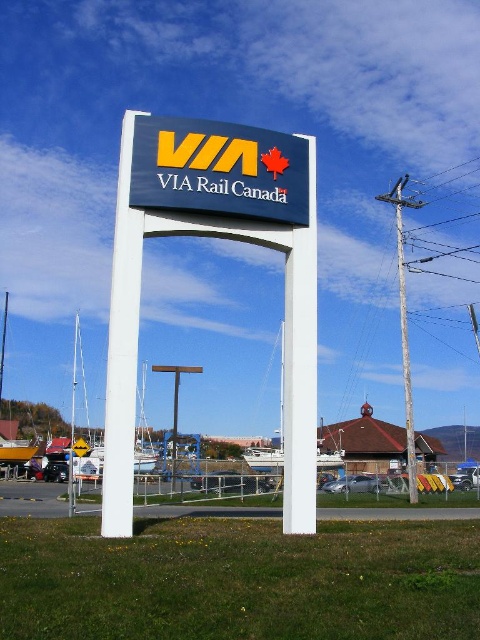
Question: Based on their relative distances, which object is nearer to the blue matte sign at center?

Choices:
 (A) weathered wood utility pole at right
 (B) white plastic sign at center

Answer: (B)

Question: Is blue matte sign at center bigger than weathered wood utility pole at right?

Choices:
 (A) no
 (B) yes

Answer: (A)

Question: Can you confirm if blue matte sign at center is positioned below weathered wood utility pole at right?

Choices:
 (A) no
 (B) yes

Answer: (A)

Question: Can you confirm if blue matte sign at center is thinner than weathered wood utility pole at right?

Choices:
 (A) no
 (B) yes

Answer: (B)

Question: Which point is farther from the camera taking this photo?

Choices:
 (A) (137, 150)
 (B) (181, 202)

Answer: (A)

Question: Estimate the real-world distances between objects in this image. Which object is farther from the blue matte sign at center?

Choices:
 (A) white plastic sign at center
 (B) weathered wood utility pole at right

Answer: (B)